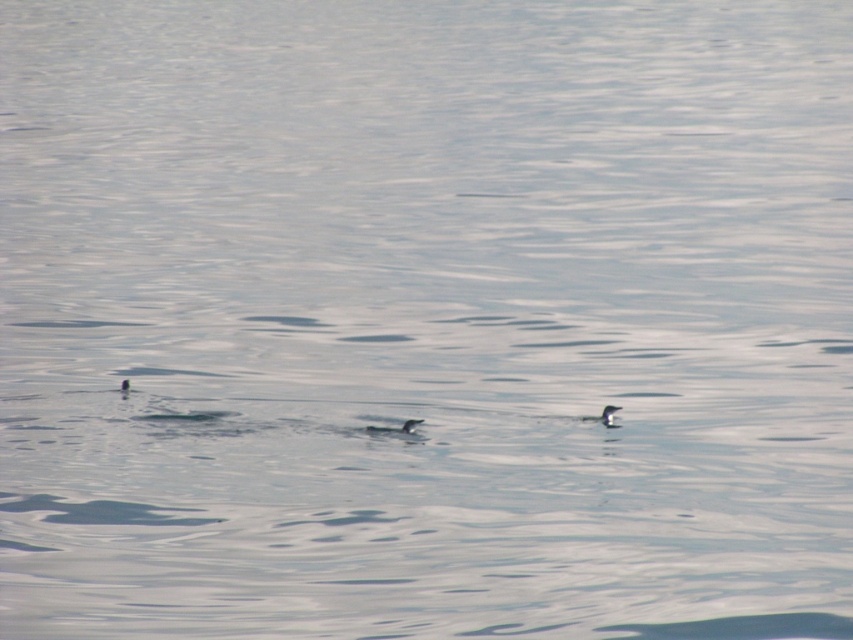
You are standing on the edge of the water and see the point marked at coordinates (x=395, y=428). What is the object located at that point?

The black glossy penguin at center is located at the coordinates (x=395, y=428).

In the scene shown: You are a photographer trying to capture the black glossy penguin at center in the image. If your camera is set to focus at the center point of the image, will the penguin be in focus?

The black glossy penguin at center is located at point (395, 428), which is slightly off the exact center of the image. Therefore, the penguin may not be in focus if the camera is set to focus at the center point.